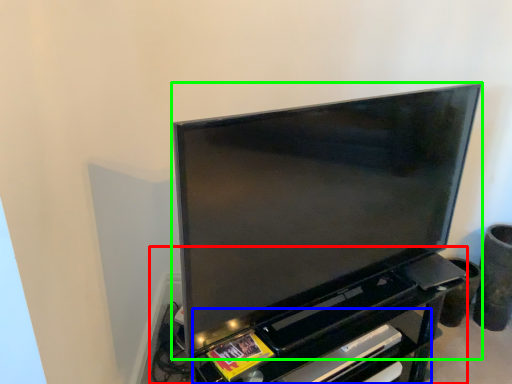
Question: Considering the real-world distances, which object is farthest from entertainment center (highlighted by a red box)? shelf (highlighted by a blue box) or television (highlighted by a green box)?

Choices:
 (A) shelf
 (B) television

Answer: (A)